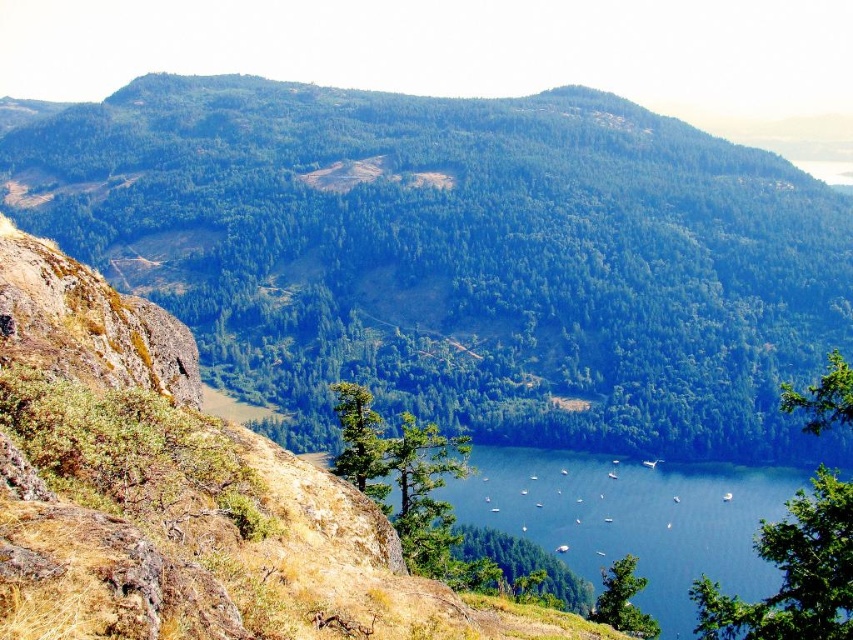
You are a hiker planning to descend from the green forested mountain at center to the blue water at center. Based on the scene, which direction should you head to reach the water?

The green forested mountain at center is located above the blue water at center, so you should head downward towards the blue water at center to reach the water.

You are a hiker planning to take a photo of the green forested mountain at center and the blue water at center from a specific viewpoint. Which object will appear taller in your photo?

The green forested mountain at center will appear taller in the photo because it has a greater height compared to the blue water at center.